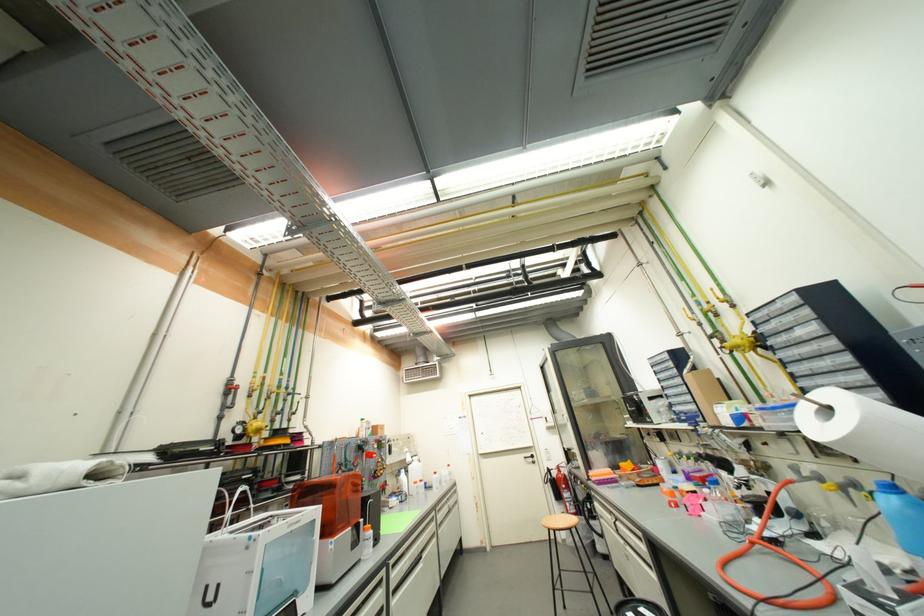
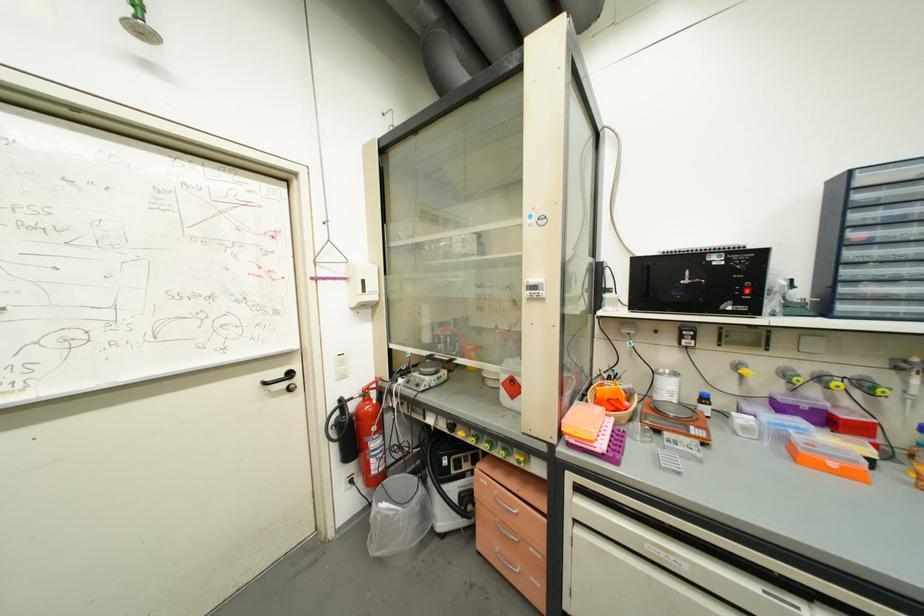
Locate, in the second image, the point that corresponds to [538,467] in the first image.

(293, 398)